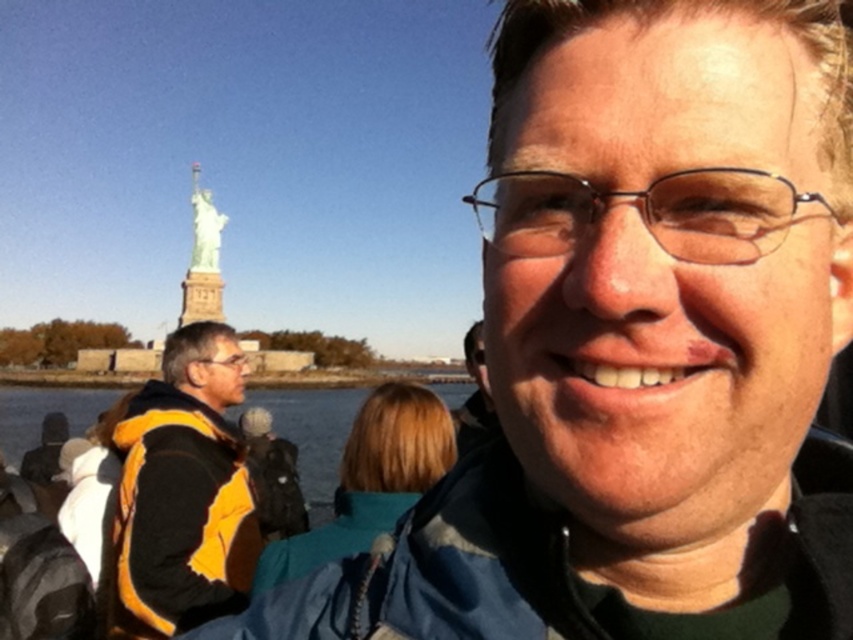
Question: Estimate the real-world distances between objects in this image. Which object is farther from the clear water at lower left?

Choices:
 (A) polished bronze statue at upper left
 (B) teal fabric jacket at center
 (C) yellow/black jacket at left

Answer: (A)

Question: Which point is closer to the camera?

Choices:
 (A) yellow/black jacket at left
 (B) polished bronze statue at upper left

Answer: (A)

Question: Which of the following is the closest to the observer?

Choices:
 (A) clear water at lower left
 (B) teal fabric jacket at center

Answer: (B)

Question: Does teal fabric jacket at center appear on the right side of clear water at lower left?

Choices:
 (A) yes
 (B) no

Answer: (A)

Question: Can you confirm if yellow/black jacket at left is positioned to the left of clear water at lower left?

Choices:
 (A) yes
 (B) no

Answer: (A)

Question: Is the position of yellow/black jacket at left less distant than that of polished bronze statue at upper left?

Choices:
 (A) yes
 (B) no

Answer: (A)